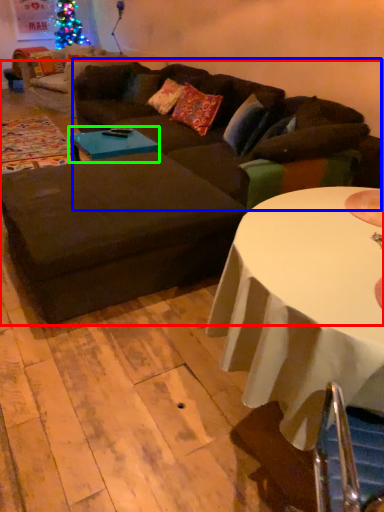
Question: Considering the real-world distances, which object is farthest from studio couch (highlighted by a red box)? couch (highlighted by a blue box) or coffee table (highlighted by a green box)?

Choices:
 (A) couch
 (B) coffee table

Answer: (B)